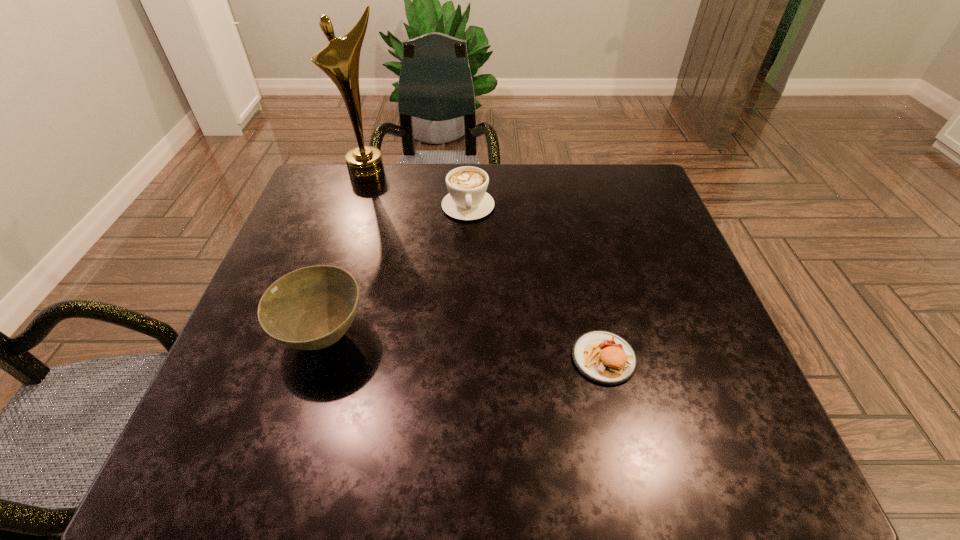
Where is `blank area located to the right of the second object from right to left's handle`? blank area located to the right of the second object from right to left's handle is located at coordinates [488, 334].

Find the location of `free space located 0.280m to the right of the second object from right to left's handle`. free space located 0.280m to the right of the second object from right to left's handle is located at coordinates (484, 307).

You are a GUI agent. You are given a task and a screenshot of the screen. Output one action in this format:
    pyautogui.click(x=<x>, y=<y>)
    Task: Click on the vacant area situated on the front-facing side of the farthest object
    
    Given the screenshot: What is the action you would take?
    pyautogui.click(x=384, y=205)

Find the location of a particular element. vacant space located on the front-facing side of the farthest object is located at coordinates (390, 218).

The height and width of the screenshot is (540, 960). What are the coordinates of `vacant region located 0.110m on the front-facing side of the farthest object` in the screenshot? It's located at (384, 205).

The width and height of the screenshot is (960, 540). Identify the location of cappuccino located at the far edge. (467, 200).

Locate an element on the screen. This screenshot has height=540, width=960. award present at the far edge is located at coordinates (339, 59).

Find the location of a particular element. bowl situated at the near edge is located at coordinates (311, 308).

Where is `patty that is at the near edge`? patty that is at the near edge is located at coordinates (604, 357).

The width and height of the screenshot is (960, 540). Identify the location of bowl situated at the left edge. (311, 308).